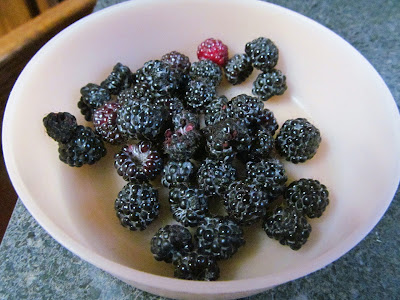
Identify the location of space in front of counter. (9, 194).